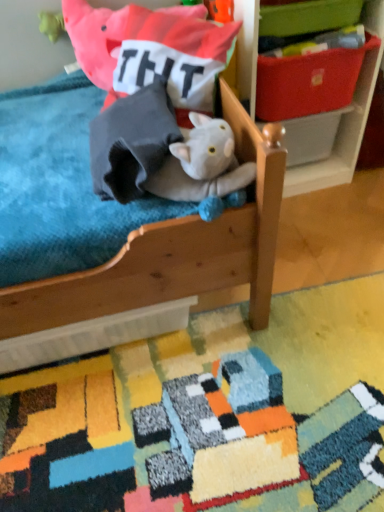
Question: Does white plastic storage box at center, the first storage box from the bottom, come in front of multicolored textured rug at lower center?

Choices:
 (A) no
 (B) yes

Answer: (A)

Question: Considering the relative sizes of white plastic storage box at center, the first storage box from the bottom, and multicolored textured rug at lower center in the image provided, is white plastic storage box at center, the first storage box from the bottom, bigger than multicolored textured rug at lower center?

Choices:
 (A) yes
 (B) no

Answer: (B)

Question: Is white plastic storage box at center, which ranks as the third storage box in top-to-bottom order, shorter than multicolored textured rug at lower center?

Choices:
 (A) yes
 (B) no

Answer: (B)

Question: Is multicolored textured rug at lower center completely or partially inside white plastic storage box at center, which ranks as the third storage box in top-to-bottom order?

Choices:
 (A) no
 (B) yes

Answer: (A)

Question: Is white plastic storage box at center, which ranks as the third storage box in top-to-bottom order, further to camera compared to multicolored textured rug at lower center?

Choices:
 (A) no
 (B) yes

Answer: (B)

Question: Looking at the image, does gray fabric stuffed animal at upper center seem bigger or smaller compared to multicolored textured rug at lower center?

Choices:
 (A) big
 (B) small

Answer: (B)

Question: From a real-world perspective, is gray fabric stuffed animal at upper center physically located above or below multicolored textured rug at lower center?

Choices:
 (A) above
 (B) below

Answer: (A)

Question: In terms of width, does gray fabric stuffed animal at upper center look wider or thinner when compared to multicolored textured rug at lower center?

Choices:
 (A) wide
 (B) thin

Answer: (B)

Question: Is gray fabric stuffed animal at upper center inside the boundaries of multicolored textured rug at lower center, or outside?

Choices:
 (A) inside
 (B) outside

Answer: (B)

Question: From a real-world perspective, relative to green fabric storage box at upper right, the 1th storage box positioned from the top, is soft cotton pillow at upper center vertically above or below?

Choices:
 (A) above
 (B) below

Answer: (B)

Question: Do you think soft cotton pillow at upper center is within green fabric storage box at upper right, arranged as the 3th storage box when ordered from the bottom, or outside of it?

Choices:
 (A) outside
 (B) inside

Answer: (A)

Question: Considering the positions of soft cotton pillow at upper center and green fabric storage box at upper right, the 1th storage box positioned from the top, in the image, is soft cotton pillow at upper center taller or shorter than green fabric storage box at upper right, the 1th storage box positioned from the top,?

Choices:
 (A) short
 (B) tall

Answer: (B)

Question: Considering the positions of point (165, 26) and point (279, 29), is point (165, 26) closer or farther from the camera than point (279, 29)?

Choices:
 (A) closer
 (B) farther

Answer: (A)

Question: In the image, is wooden shelf at upper right positioned in front of or behind white plastic storage box at center, the first storage box from the bottom?

Choices:
 (A) behind
 (B) front

Answer: (B)

Question: From the image's perspective, relative to white plastic storage box at center, the first storage box from the bottom, is wooden shelf at upper right above or below?

Choices:
 (A) below
 (B) above

Answer: (B)